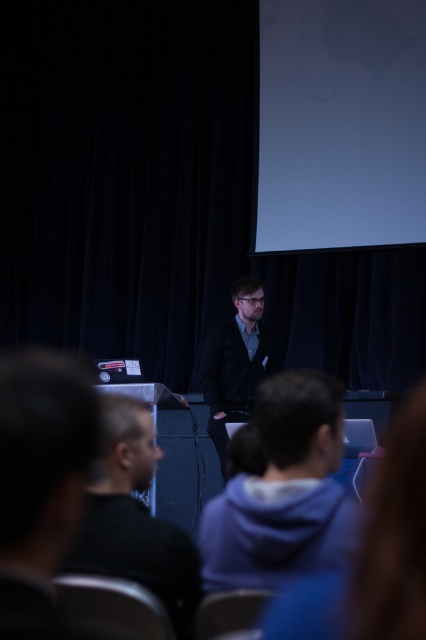
Question: Does dark gray hoodie at center appear on the left side of dark gray hoodie at lower center?

Choices:
 (A) no
 (B) yes

Answer: (A)

Question: Is dark gray hoodie at center closer to camera compared to dark gray hoodie at lower center?

Choices:
 (A) yes
 (B) no

Answer: (B)

Question: Which is farther from the dark blue jacket at center?

Choices:
 (A) dark gray hoodie at lower center
 (B) dark gray hoodie at center

Answer: (B)

Question: Among these objects, which one is nearest to the camera?

Choices:
 (A) dark blue jacket at center
 (B) dark gray hoodie at center

Answer: (B)

Question: Which point is farther to the camera?

Choices:
 (A) dark gray hoodie at lower center
 (B) dark gray hoodie at center

Answer: (B)

Question: Can you confirm if dark gray hoodie at lower center is bigger than dark blue jacket at center?

Choices:
 (A) no
 (B) yes

Answer: (A)